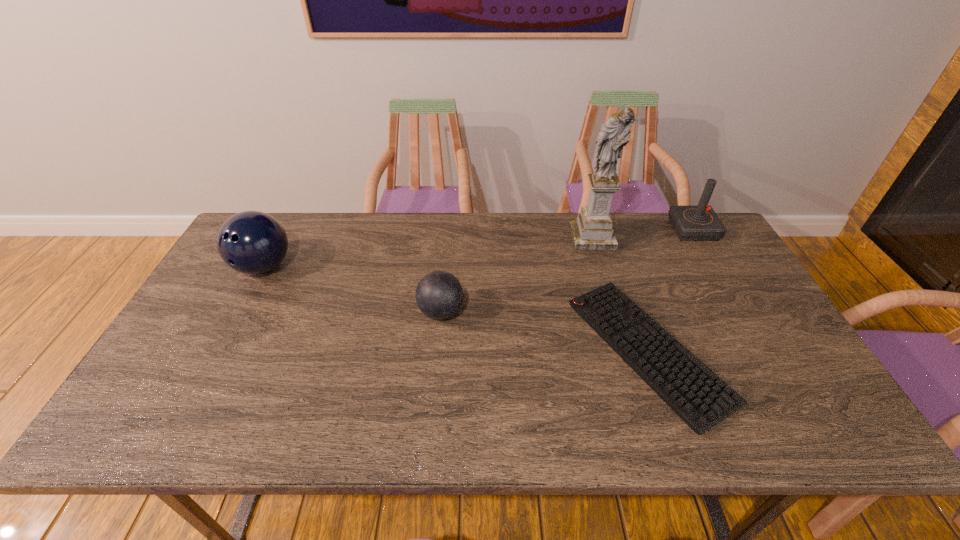
The image size is (960, 540). I want to click on free spot located 0.210m on the rectangular base of the joystick, so click(610, 230).

Find the location of `free point located 0.220m on the surface of the taller bowling ball near the finger holes`. free point located 0.220m on the surface of the taller bowling ball near the finger holes is located at coordinates (220, 348).

Where is `vacant region located on the grip area of the shorter bowling ball`? Image resolution: width=960 pixels, height=540 pixels. vacant region located on the grip area of the shorter bowling ball is located at coordinates (588, 312).

At what (x,y) coordinates should I click in order to perform the action: click on vacant space located 0.320m on the back of the shortest object. Please return your answer as a coordinate pair (x, y). This screenshot has height=540, width=960. Looking at the image, I should click on (603, 222).

Image resolution: width=960 pixels, height=540 pixels. I want to click on sculpture at the far edge, so click(x=593, y=230).

At what (x,y) coordinates should I click in order to perform the action: click on joystick at the far edge. Please return your answer as a coordinate pair (x, y). Looking at the image, I should click on (691, 223).

Where is `bowling ball situated at the far edge`? bowling ball situated at the far edge is located at coordinates (252, 242).

This screenshot has height=540, width=960. In order to click on object that is at the near edge in this screenshot , I will do `click(693, 391)`.

Locate an element on the screen. The width and height of the screenshot is (960, 540). object that is at the left edge is located at coordinates (252, 242).

This screenshot has width=960, height=540. I want to click on object situated at the right edge, so point(691,223).